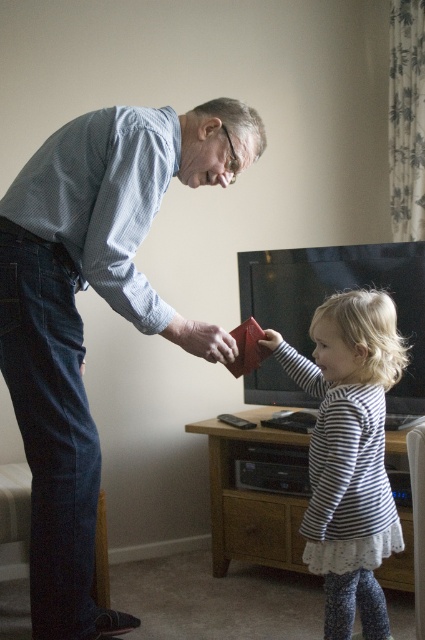
Does matte blue shirt at upper left appear over striped fabric dress at center?

Indeed, matte blue shirt at upper left is positioned over striped fabric dress at center.

Which is in front, point (71, 540) or point (350, 522)?

Point (71, 540)

Is point (206, 144) farther from camera compared to point (328, 493)?

Yes, it is behind point (328, 493).

I want to click on matte blue shirt at upper left, so click(x=79, y=316).

Between matte blue shirt at upper left and matte red wallet at center, which one appears on the left side from the viewer's perspective?

matte blue shirt at upper left

Which is behind, point (85, 214) or point (209, 355)?

Point (209, 355)

Find the location of a particular element. Image resolution: width=425 pixels, height=640 pixels. matte blue shirt at upper left is located at coordinates (79, 316).

Is striped fabric dress at center bigger than matte red wallet at center?

Correct, striped fabric dress at center is larger in size than matte red wallet at center.

Is striped fabric dress at center above matte red wallet at center?

Incorrect, striped fabric dress at center is not positioned above matte red wallet at center.

Between point (351, 352) and point (226, 356), which one is positioned behind?

The point (226, 356) is behind.

Locate an element on the screen. The height and width of the screenshot is (640, 425). striped fabric dress at center is located at coordinates (348, 452).